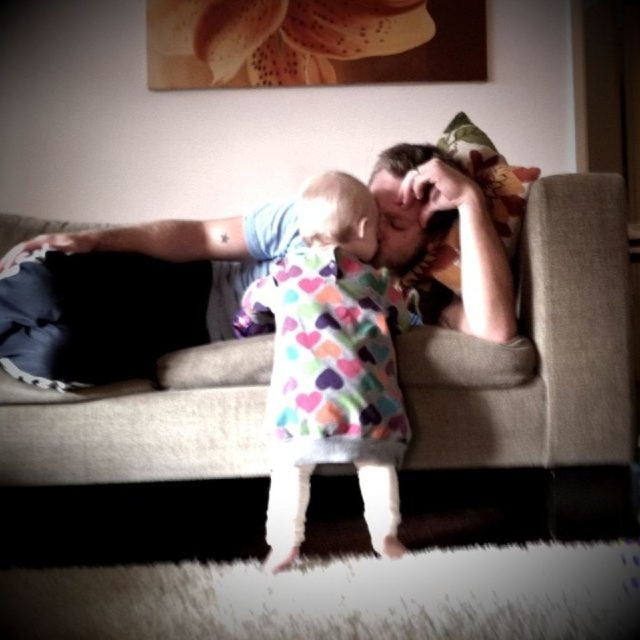
You are an interior designer planning to place a new lamp on the beige fabric couch at center. Considering the position of the matte blue shirt at center, will the lamp be placed above or below the shirt?

The beige fabric couch at center is located below matte blue shirt at center, so placing the lamp on the couch would position it below the shirt.

What is the color of the shirt at the point specified by coordinates (152, 288)?

The point at (152, 288) is on the matte blue shirt at center, so the color is blue.